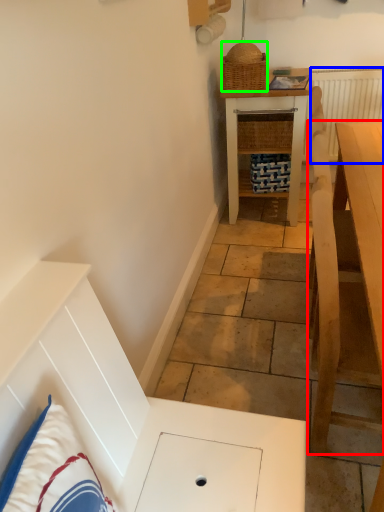
Question: Which object is the closest to the table (highlighted by a red box)? Choose among these: radiator (highlighted by a blue box) or picnic basket (highlighted by a green box).

Choices:
 (A) radiator
 (B) picnic basket

Answer: (B)